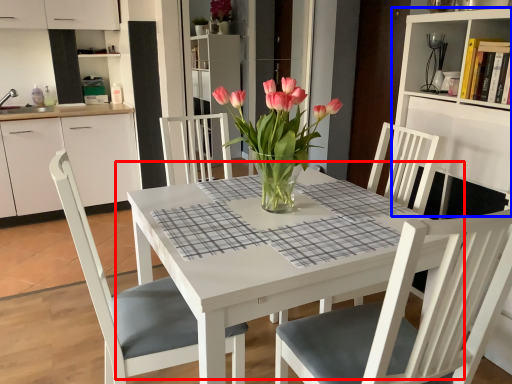
Question: Among these objects, which one is nearest to the camera, kitchen & dining room table (highlighted by a red box) or bookshelf (highlighted by a blue box)?

Choices:
 (A) kitchen & dining room table
 (B) bookshelf

Answer: (A)